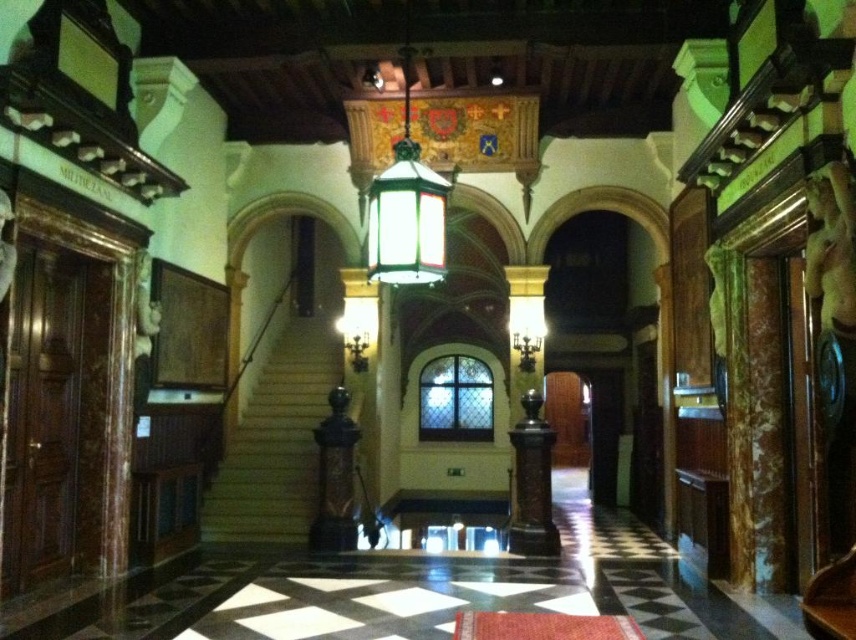
Can you confirm if wooden staircase at center is positioned to the left of brown polished wood pillar at center?

Yes, wooden staircase at center is to the left of brown polished wood pillar at center.

Is point (301, 396) in front of point (515, 493)?

That is False.

I want to click on wooden staircase at center, so (276, 442).

Where is `wooden staircase at center`? The width and height of the screenshot is (856, 640). wooden staircase at center is located at coordinates (276, 442).